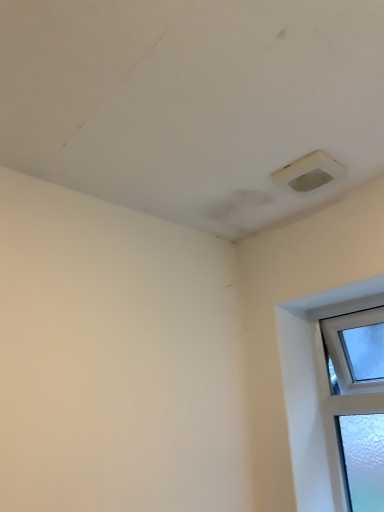
Question: Should I look upward or downward to see white plastic air conditioning at upper right?

Choices:
 (A) up
 (B) down

Answer: (A)

Question: Is white plastic air conditioning at upper right wider than clear glass window at lower right?

Choices:
 (A) no
 (B) yes

Answer: (B)

Question: From a real-world perspective, is white plastic air conditioning at upper right below clear glass window at lower right?

Choices:
 (A) no
 (B) yes

Answer: (A)

Question: Can you confirm if white plastic air conditioning at upper right is shorter than clear glass window at lower right?

Choices:
 (A) yes
 (B) no

Answer: (A)

Question: Considering the relative sizes of white plastic air conditioning at upper right and clear glass window at lower right in the image provided, is white plastic air conditioning at upper right smaller than clear glass window at lower right?

Choices:
 (A) yes
 (B) no

Answer: (A)

Question: Is white plastic air conditioning at upper right oriented away from clear glass window at lower right?

Choices:
 (A) yes
 (B) no

Answer: (B)

Question: Considering the relative sizes of white plastic air conditioning at upper right and clear glass window at lower right in the image provided, is white plastic air conditioning at upper right thinner than clear glass window at lower right?

Choices:
 (A) yes
 (B) no

Answer: (B)

Question: From a real-world perspective, is clear glass window at lower right located higher than white plastic air conditioning at upper right?

Choices:
 (A) no
 (B) yes

Answer: (A)

Question: Is clear glass window at lower right smaller than white plastic air conditioning at upper right?

Choices:
 (A) yes
 (B) no

Answer: (B)

Question: Can you confirm if clear glass window at lower right is positioned to the right of white plastic air conditioning at upper right?

Choices:
 (A) yes
 (B) no

Answer: (A)

Question: Is clear glass window at lower right outside of white plastic air conditioning at upper right?

Choices:
 (A) no
 (B) yes

Answer: (B)

Question: Is white plastic air conditioning at upper right at the back of clear glass window at lower right?

Choices:
 (A) no
 (B) yes

Answer: (A)

Question: From the image's perspective, is clear glass window at lower right located above white plastic air conditioning at upper right?

Choices:
 (A) yes
 (B) no

Answer: (B)

Question: Based on their positions, is white plastic air conditioning at upper right located to the left or right of clear glass window at lower right?

Choices:
 (A) left
 (B) right

Answer: (A)